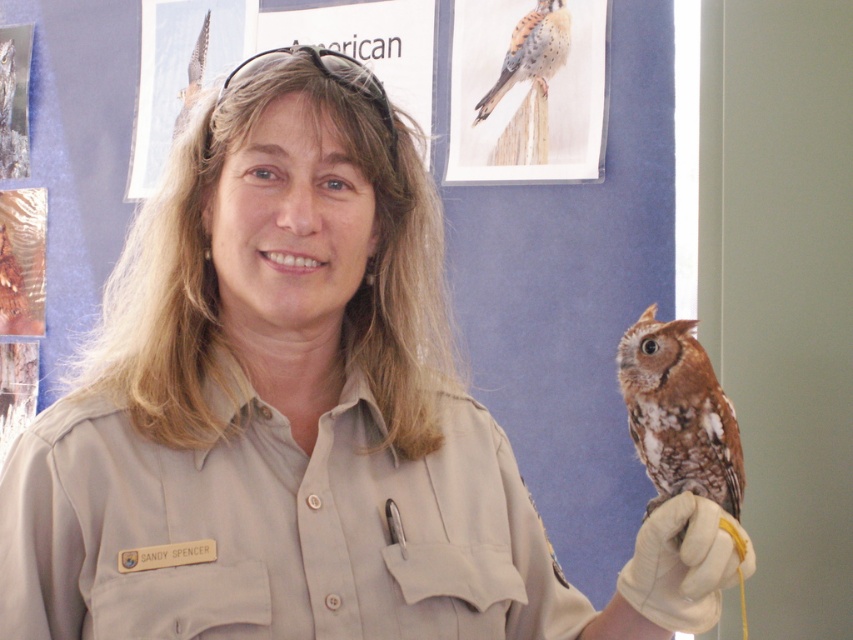
Question: Among these points, which one is nearest to the camera?

Choices:
 (A) (729, 429)
 (B) (751, 573)
 (C) (540, 33)

Answer: (B)

Question: Can you confirm if brown speckled owl at right is bigger than white leather glove at lower right?

Choices:
 (A) yes
 (B) no

Answer: (A)

Question: Which object appears farthest from the camera in this image?

Choices:
 (A) brown speckled feathers at upper center
 (B) white leather glove at lower right
 (C) brown speckled owl at right

Answer: (A)

Question: Can you confirm if brown speckled owl at right is positioned to the right of brown speckled feathers at upper center?

Choices:
 (A) no
 (B) yes

Answer: (B)

Question: Which is nearer to the white leather glove at lower right?

Choices:
 (A) brown speckled feathers at upper center
 (B) brown speckled owl at right

Answer: (B)

Question: Is white leather glove at lower right smaller than brown speckled feathers at upper center?

Choices:
 (A) yes
 (B) no

Answer: (A)